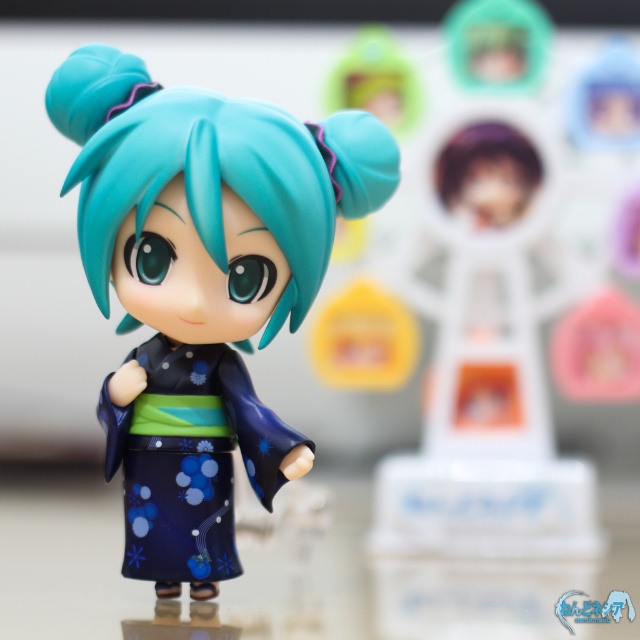
Does point (221, 552) come behind point (129, 477)?

That is False.

Which is more to the left, matte blue kimono doll at center or blue satin kimono at center?

blue satin kimono at center

Between point (92, 273) and point (224, 541), which one is positioned in front?

Point (92, 273)

This screenshot has width=640, height=640. Identify the location of matte blue kimono doll at center. (202, 285).

Can you confirm if blue satin kimono at center is bigger than purple matte hair at upper center?

Correct, blue satin kimono at center is larger in size than purple matte hair at upper center.

Is blue satin kimono at center closer to camera compared to purple matte hair at upper center?

That is True.

The width and height of the screenshot is (640, 640). I want to click on blue satin kimono at center, so click(189, 458).

At what (x,y) coordinates should I click in order to perform the action: click on matte blue kimono doll at center. Please return your answer as a coordinate pair (x, y). Looking at the image, I should click on (202, 285).

Does matte blue kimono doll at center have a greater width compared to purple matte hair at upper center?

Correct, the width of matte blue kimono doll at center exceeds that of purple matte hair at upper center.

Who is more distant from viewer, (140,508) or (534,188)?

The point (534,188) is behind.

Where is `matte blue kimono doll at center`? This screenshot has width=640, height=640. matte blue kimono doll at center is located at coordinates (202, 285).